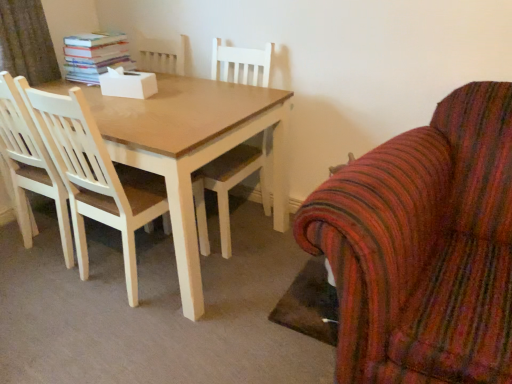
Image resolution: width=512 pixels, height=384 pixels. I want to click on free space to the left of light wood chair at left, positioned as the 1th chair in left-to-right order, so click(35, 287).